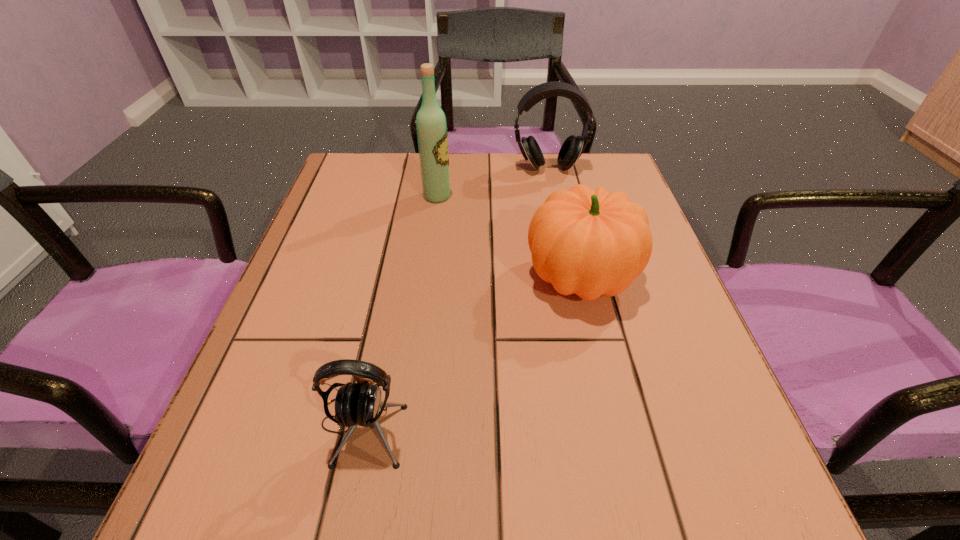
The width and height of the screenshot is (960, 540). I want to click on free point between the second nearest object and the second farthest object, so click(509, 237).

Locate an element on the screen. vacant space that's between the second nearest object and the shorter earphone is located at coordinates 471,352.

The height and width of the screenshot is (540, 960). What are the coordinates of `free area in between the wine bottle and the third farthest object` in the screenshot? It's located at (509, 237).

Identify which object is the closest to the nearer earphone. Please provide its 2D coordinates. Your answer should be formatted as a tuple, i.e. [(x, y)], where the tuple contains the x and y coordinates of a point satisfying the conditions above.

[(587, 242)]

Identify the location of object that is the closest to the third nearest object. This screenshot has width=960, height=540. (572, 148).

Where is `vacant position in the image that satisfies the following two spatial constraints: 1. on the front-facing side of the second farthest object; 2. on the right side of the second nearest object`? This screenshot has width=960, height=540. vacant position in the image that satisfies the following two spatial constraints: 1. on the front-facing side of the second farthest object; 2. on the right side of the second nearest object is located at coordinates (427, 278).

The image size is (960, 540). What are the coordinates of `vacant area that satisfies the following two spatial constraints: 1. on the ear cups of the farthest object; 2. on the front-facing side of the third nearest object` in the screenshot? It's located at (554, 196).

Where is `free spot that satisfies the following two spatial constraints: 1. on the front-facing side of the third farthest object; 2. on the left side of the tallest object`? This screenshot has width=960, height=540. free spot that satisfies the following two spatial constraints: 1. on the front-facing side of the third farthest object; 2. on the left side of the tallest object is located at coordinates (427, 278).

Where is `vacant space that satisfies the following two spatial constraints: 1. on the front-facing side of the pumpkin; 2. on the right side of the second farthest object`? Image resolution: width=960 pixels, height=540 pixels. vacant space that satisfies the following two spatial constraints: 1. on the front-facing side of the pumpkin; 2. on the right side of the second farthest object is located at coordinates (427, 278).

Image resolution: width=960 pixels, height=540 pixels. I want to click on vacant area in the image that satisfies the following two spatial constraints: 1. on the ear cups of the farther earphone; 2. on the left side of the pumpkin, so click(x=572, y=278).